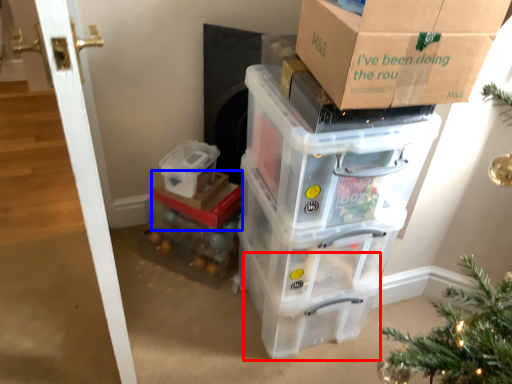
Question: Among these objects, which one is farthest to the camera, storage box (highlighted by a red box) or storage box (highlighted by a blue box)?

Choices:
 (A) storage box
 (B) storage box

Answer: (B)